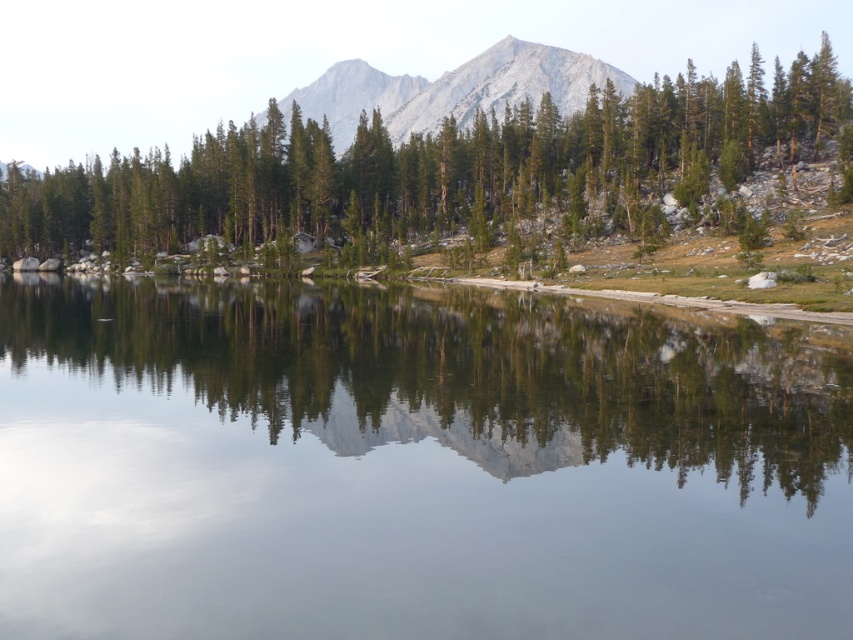
You are standing at the edge of the lake in the serene landscape. There are two points marked in the scene, point 1 at coordinates point (231,492) and point 2 at coordinates point (73,211). Which point is closer to you?

Point (231,492) is closer to the camera than point (73,211), so the point closer to you is point (231,492).

You are a hiker standing at the point labeled point (432, 166) in the image. Looking around, you see the green matte tree at center. Based on your position, which direction would you face to have the green matte tree at center directly in front of you?

Since the point (432, 166) corresponds to the green matte tree at center, you are already facing the tree directly. Therefore, you don not need to turn. You are already facing the green matte tree at center directly.